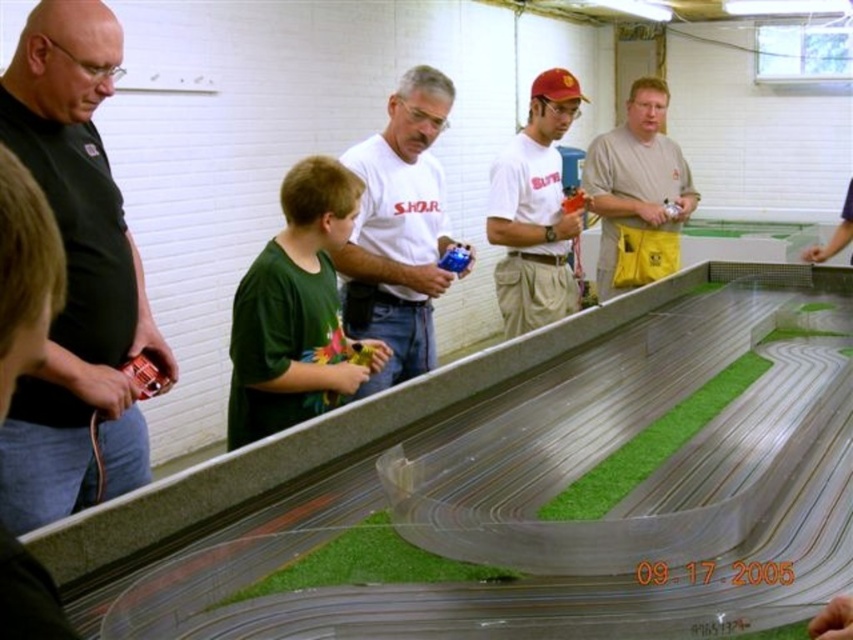
You are a photographer trying to capture a clear shot of both the light brown cotton shirt at center and the blue plastic toy at center. Since you want to ensure both are in focus, you need to know which object is wider. Which one is wider?

The light brown cotton shirt at center is wider than the blue plastic toy at center.